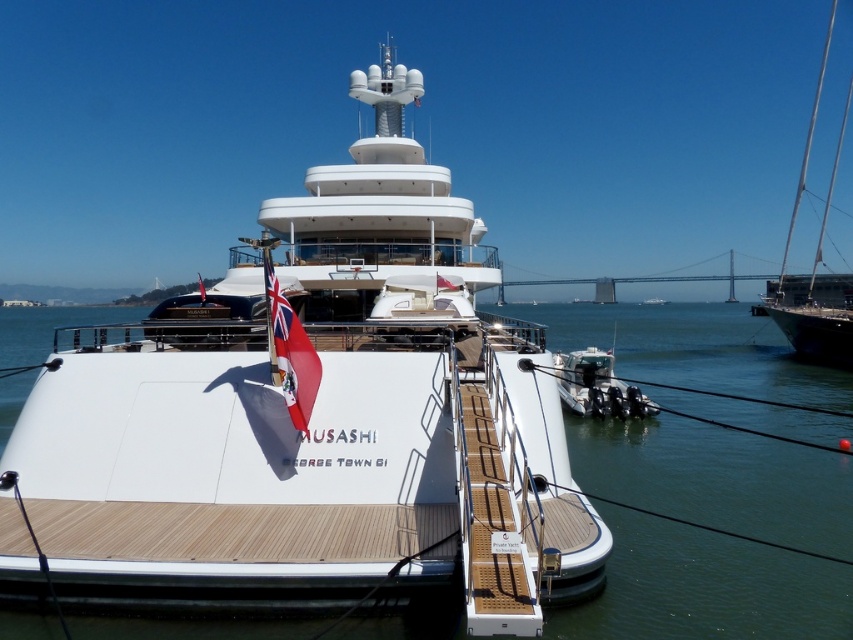
You are standing on the red fabric flag at lower left and want to move to the white wooden deck at center. Which direction should you move to reach it?

You should move to your right to reach the white wooden deck at center since it is located to the right of the red fabric flag at lower left.

You are on the deck of the yacht MUSASHI and want to move from the point at coordinates point [410,300] to the point at coordinates point [793,326]. Which direction should you face to move towards your destination?

Since point [410,300] is in front of point [793,326], you should face backward to move from point [410,300] towards point [793,326].